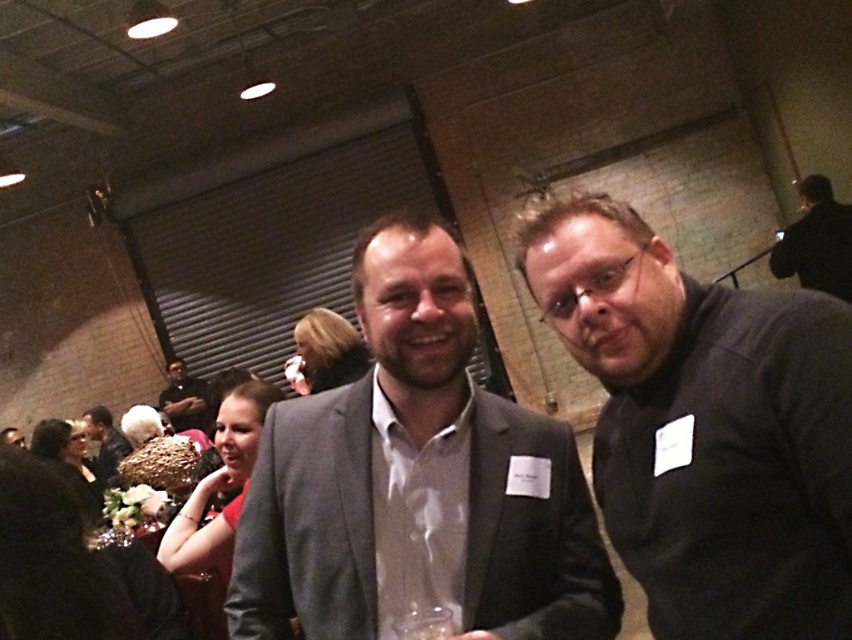
Question: Does dark gray sweater at right appear over black matte jacket at upper right?

Choices:
 (A) no
 (B) yes

Answer: (A)

Question: Is black matte jacket at upper right smaller than dark gray suit at center?

Choices:
 (A) yes
 (B) no

Answer: (B)

Question: Among these points, which one is farthest from the camera?

Choices:
 (A) [x=96, y=465]
 (B) [x=177, y=422]
 (C) [x=802, y=252]

Answer: (B)

Question: Which object appears closest to the camera in this image?

Choices:
 (A) matte gray suit at center
 (B) black matte jacket at upper right
 (C) dark gray suit at center

Answer: (A)

Question: Which of the following is the farthest from the observer?

Choices:
 (A) (776, 252)
 (B) (170, 358)
 (C) (304, 428)

Answer: (B)

Question: Can you confirm if black matte jacket at upper right is positioned to the right of matte black suit at center?

Choices:
 (A) yes
 (B) no

Answer: (A)